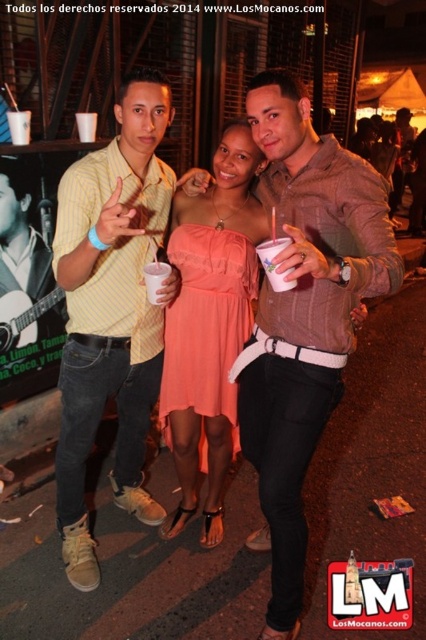
Question: Is white plastic cup at center further to camera compared to pink plastic cup at center?

Choices:
 (A) yes
 (B) no

Answer: (B)

Question: Does yellow striped shirt at center have a greater width compared to pink plastic cup at center?

Choices:
 (A) no
 (B) yes

Answer: (B)

Question: Estimate the real-world distances between objects in this image. Which object is farther from the matte coral dress at center?

Choices:
 (A) white plastic cup at center
 (B) pink plastic cup at center
 (C) brown textured shirt at center
 (D) yellow striped shirt at center

Answer: (A)

Question: Does brown textured shirt at center appear under white plastic cup at center?

Choices:
 (A) no
 (B) yes

Answer: (B)

Question: Which point is farther to the camera?

Choices:
 (A) brown textured shirt at center
 (B) white plastic cup at center

Answer: (B)

Question: Which point is closer to the camera?

Choices:
 (A) pos(288,83)
 (B) pos(221,509)

Answer: (A)